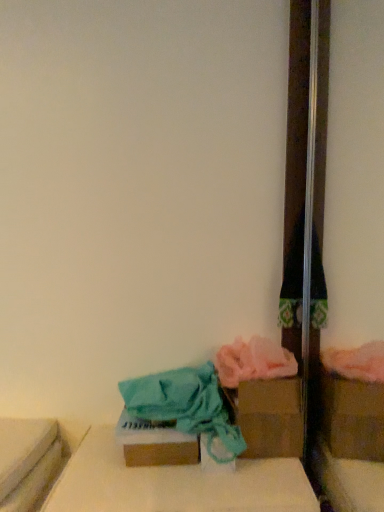
Question: Relative to cardboard box at lower center, is brown cardboard box at lower center, placed as the first storage box when sorted from front to back, in front or behind?

Choices:
 (A) front
 (B) behind

Answer: (B)

Question: Considering the positions of brown cardboard box at lower center, the first storage box from the left, and cardboard box at lower center in the image, is brown cardboard box at lower center, the first storage box from the left, wider or thinner than cardboard box at lower center?

Choices:
 (A) thin
 (B) wide

Answer: (A)

Question: Estimate the real-world distances between objects in this image. Which object is farther from the brown cardboard box at lower center, the first storage box from the left?

Choices:
 (A) cardboard box at lower center
 (B) brown cardboard box at lower right, the second storage box positioned from the left

Answer: (B)

Question: Based on their relative distances, which object is farther from the cardboard box at lower center?

Choices:
 (A) brown cardboard box at lower right, which appears as the first storage box when viewed from the right
 (B) brown cardboard box at lower center, placed as the first storage box when sorted from front to back

Answer: (A)